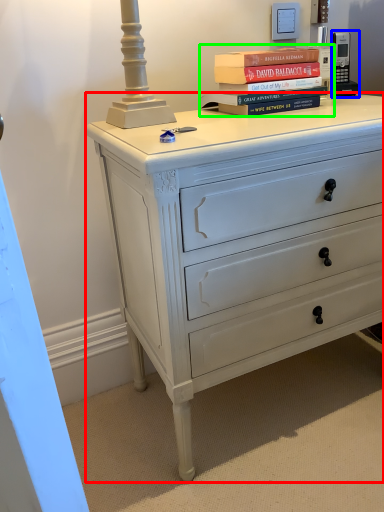
Question: Considering the real-world distances, which object is farthest from chest of drawers (highlighted by a red box)? gadget (highlighted by a blue box) or book (highlighted by a green box)?

Choices:
 (A) gadget
 (B) book

Answer: (A)